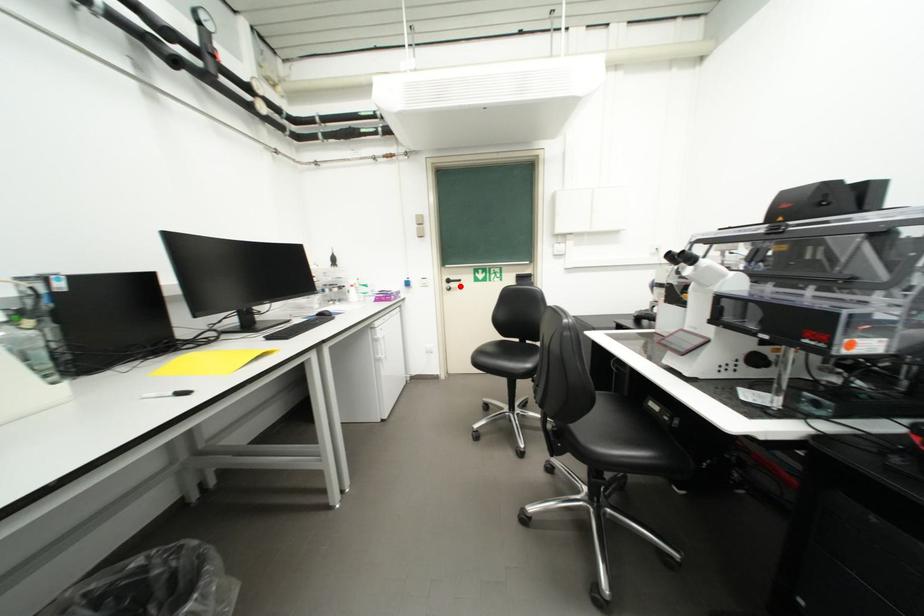
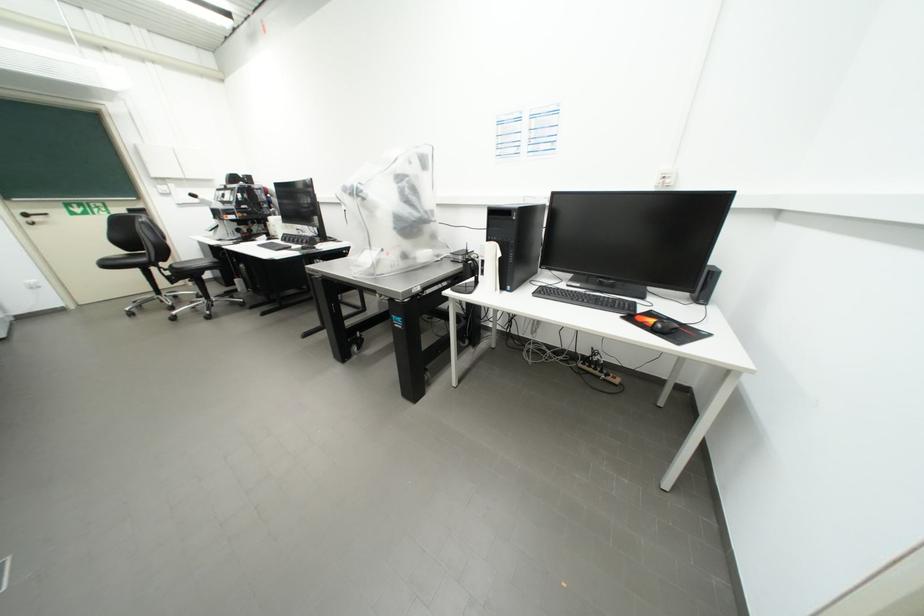
Where in the second image is the point corresponding to the highlighted location from the first image?

(43, 220)